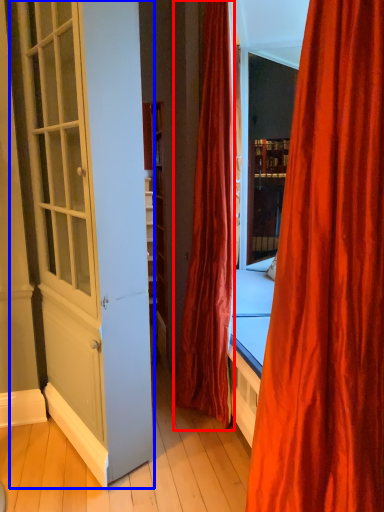
Question: Which object appears farthest to the camera in this image, curtain (highlighted by a red box) or screen door (highlighted by a blue box)?

Choices:
 (A) curtain
 (B) screen door

Answer: (A)